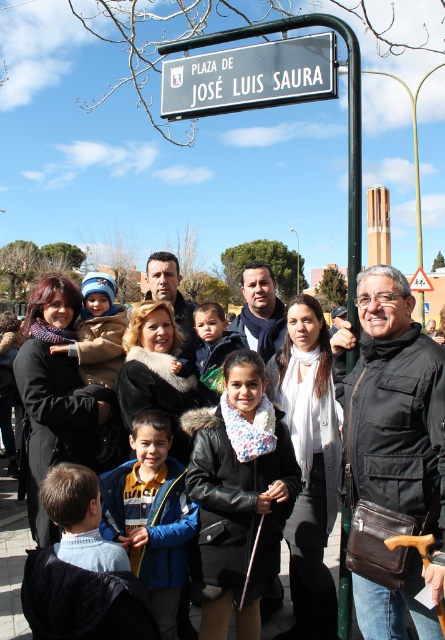
Is blue fleece jacket at center above light brown hair at center?

No, blue fleece jacket at center is not above light brown hair at center.

Does blue fleece jacket at center have a greater width compared to light brown hair at center?

Correct, the width of blue fleece jacket at center exceeds that of light brown hair at center.

Describe the element at coordinates (152, 515) in the screenshot. The width and height of the screenshot is (445, 640). I see `blue fleece jacket at center` at that location.

You are a GUI agent. You are given a task and a screenshot of the screen. Output one action in this format:
    pyautogui.click(x=<x>, y=<y>)
    Task: Click on the blue fleece jacket at center
    
    Given the screenshot: What is the action you would take?
    pyautogui.click(x=152, y=515)

Looking at this image, between brown leather bag at center and white plastic street sign at upper center, which one is positioned lower?

brown leather bag at center is lower down.

Is point (396, 381) farther from camera compared to point (249, 76)?

No, it is not.

Which is in front, point (368, 512) or point (334, 60)?

Point (368, 512)

Where is `brown leather bag at center`? This screenshot has width=445, height=640. brown leather bag at center is located at coordinates (393, 458).

Does dark brown leather jacket at center have a larger size compared to light brown hair at center?

Yes.

What do you see at coordinates (258, 298) in the screenshot? I see `dark brown leather jacket at center` at bounding box center [258, 298].

Is point (292, 332) more distant than point (199, 324)?

No, it is not.

Locate an element on the screen. Image resolution: width=445 pixels, height=640 pixels. dark brown leather jacket at center is located at coordinates (258, 298).